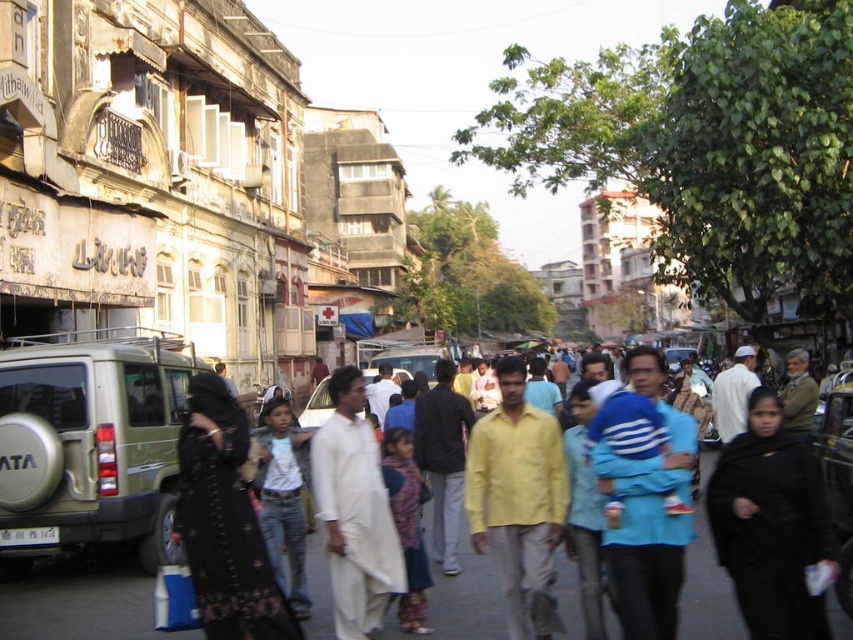
Question: Which point is farther from the camera taking this photo?

Choices:
 (A) (560, 472)
 (B) (442, 624)
 (C) (132, 422)

Answer: (C)

Question: Can you confirm if matte gold suv at left is positioned to the left of matte white shirt at center?

Choices:
 (A) no
 (B) yes

Answer: (B)

Question: Does matte gold suv at left appear under black fabric at center?

Choices:
 (A) no
 (B) yes

Answer: (A)

Question: Which point is farther from the camera taking this photo?

Choices:
 (A) (520, 557)
 (B) (715, 572)
 (C) (335, 448)
 (D) (746, 566)

Answer: (B)

Question: Can you confirm if black textured dress at center is smaller than yellow matte shirt at center?

Choices:
 (A) no
 (B) yes

Answer: (A)

Question: Estimate the real-world distances between objects in this image. Which object is farther from the yellow matte shirt at center?

Choices:
 (A) white cotton kurta at center
 (B) black textured dress at center

Answer: (B)